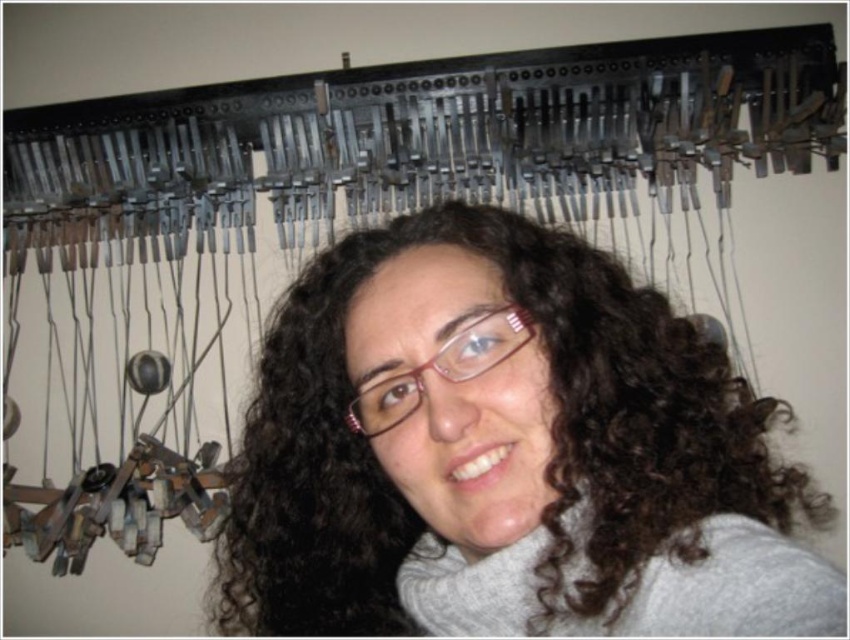
Between dark brown curly hair at center and pink plastic glasses at center, which one is positioned higher?

Positioned higher is pink plastic glasses at center.

Can you confirm if dark brown curly hair at center is wider than pink plastic glasses at center?

Correct, the width of dark brown curly hair at center exceeds that of pink plastic glasses at center.

Is point (293, 472) positioned after point (400, 400)?

Yes, it is.

Locate an element on the screen. This screenshot has height=640, width=850. dark brown curly hair at center is located at coordinates (507, 452).